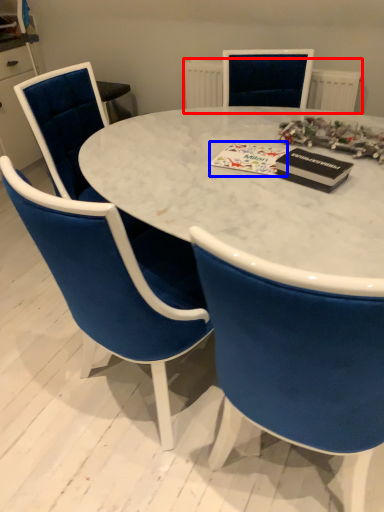
Question: Which point is closer to the camera, radiator (highlighted by a red box) or christmas card (highlighted by a blue box)?

Choices:
 (A) radiator
 (B) christmas card

Answer: (B)